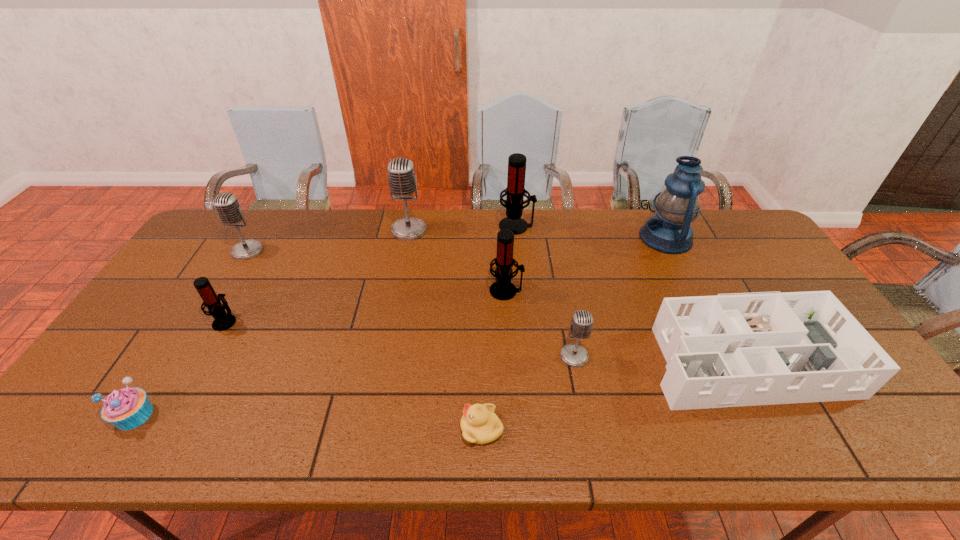
Locate an element on the screen. empty space that is in between the third farthest microphone and the biggest gray microphone is located at coordinates (328, 240).

This screenshot has width=960, height=540. In order to click on empty space between the ninth tallest object and the third object from right to left in this screenshot , I will do `click(354, 386)`.

The height and width of the screenshot is (540, 960). Identify the location of vacant area between the third farthest microphone and the lantern. (457, 244).

The image size is (960, 540). Find the location of `empty location between the smallest red microphone and the third farthest microphone`. empty location between the smallest red microphone and the third farthest microphone is located at coordinates (236, 286).

What are the coordinates of `free point between the biggest red microphone and the blue muffin` in the screenshot? It's located at (325, 320).

Point out which object is positioned as the fourth nearest to the farthest red microphone. Please provide its 2D coordinates. Your answer should be formatted as a tuple, i.e. [(x, y)], where the tuple contains the x and y coordinates of a point satisfying the conditions above.

[(750, 349)]

Where is `object that ranks as the closest to the leftmost red microphone`? The image size is (960, 540). object that ranks as the closest to the leftmost red microphone is located at coordinates (127, 408).

I want to click on microphone object that ranks as the fifth closest to the second biggest red microphone, so click(x=227, y=206).

You are a GUI agent. You are given a task and a screenshot of the screen. Output one action in this format:
    pyautogui.click(x=<x>, y=<y>)
    Task: Click on the microphone that is the fifth closest one to the dollhouse
    The height and width of the screenshot is (540, 960).
    Given the screenshot: What is the action you would take?
    point(223,321)

Where is `red microphone identified as the second closest to the duckling`? The image size is (960, 540). red microphone identified as the second closest to the duckling is located at coordinates (515, 191).